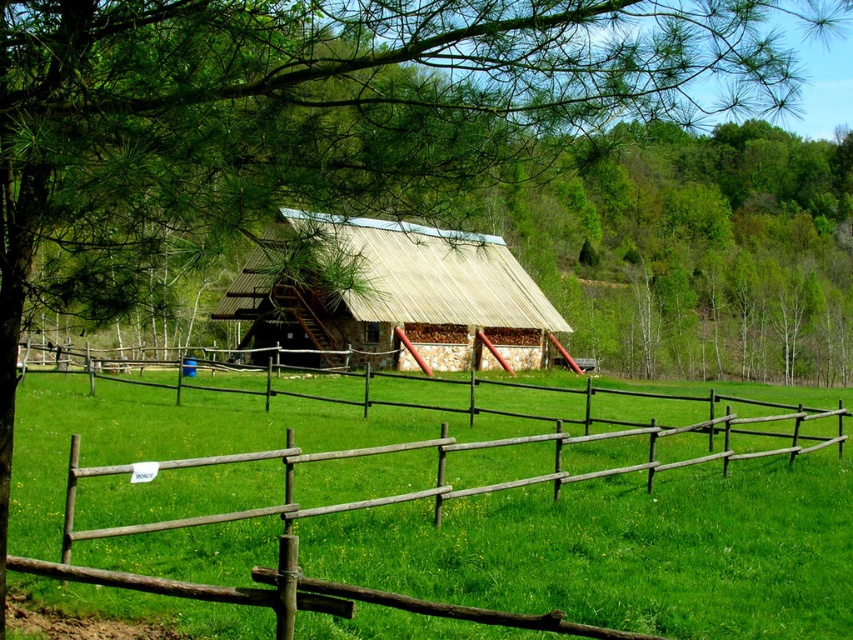
You are a visitor standing in front of the rustic wooden structure. You notice a brown wooden fence at center and a wooden thatched hut at center. Which one is taller?

The wooden thatched hut at center is taller than the brown wooden fence at center.

You are planning to place a new garden bench between the brown wooden fence at center and the wooden thatched hut at center. Based on their widths, which object should you place the bench closer to to ensure it fits comfortably?

The bench should be placed closer to the wooden thatched hut at center because the brown wooden fence at center might be wider, leaving more space near the hut for the bench.